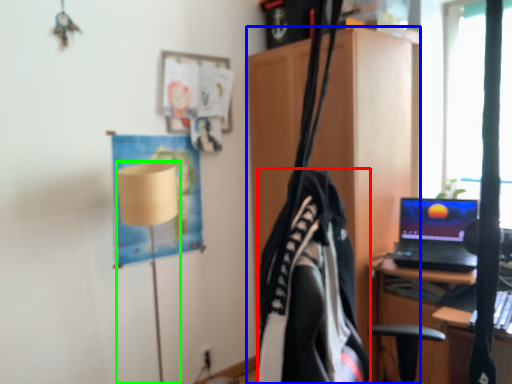
Question: Which object is positioned closest to clothing (highlighted by a red box)? Select from cabinetry (highlighted by a blue box) and table lamp (highlighted by a green box).

Choices:
 (A) cabinetry
 (B) table lamp

Answer: (B)